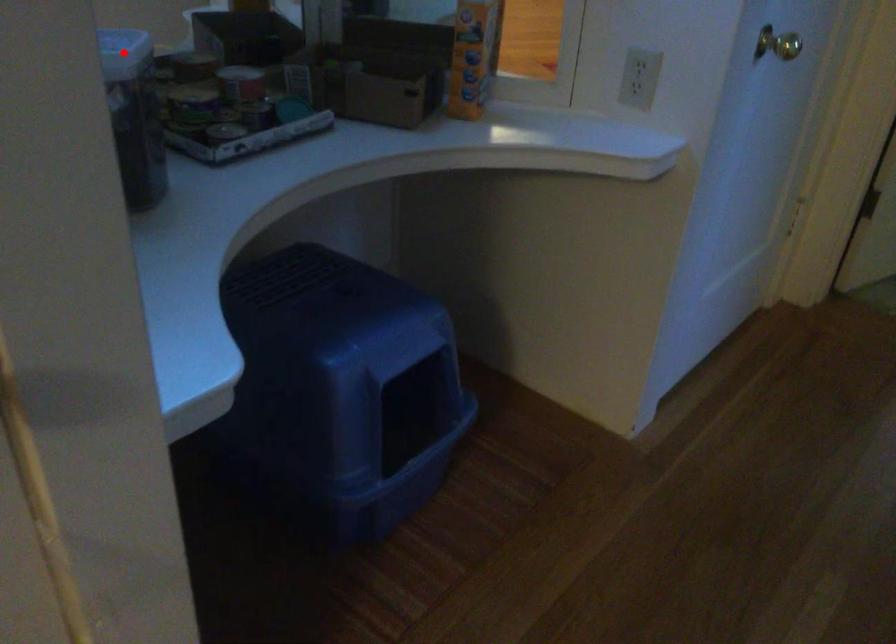
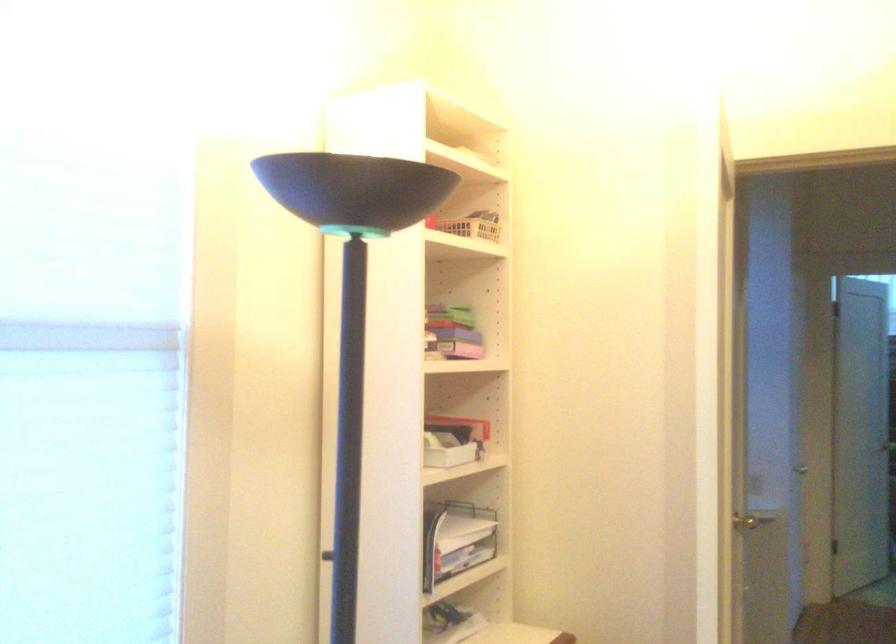
Question: I am providing you with two images of the same scene from different viewpoints. A red point is marked on the first image. Is the red point's position out of view in image 2?

Choices:
 (A) Yes
 (B) No

Answer: (A)